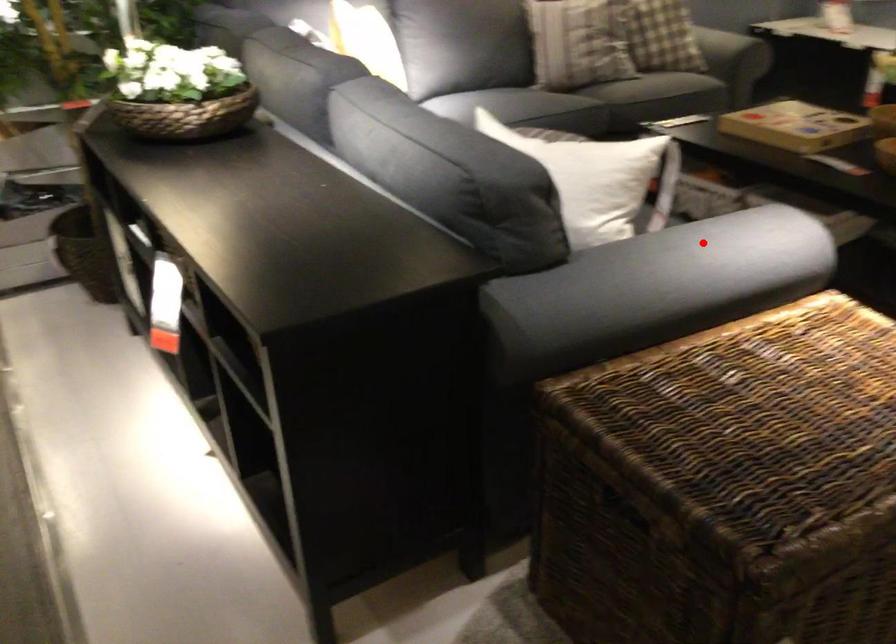
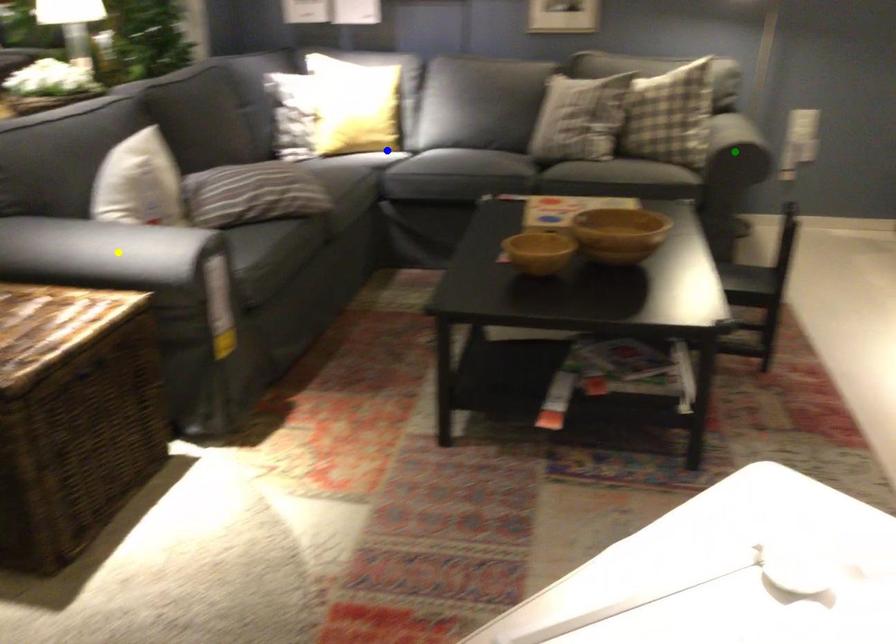
Question: I am providing you with two images of the same scene from different viewpoints. A red point is marked on the first image. You are given multiple points on the second image. Which spot in image 2 lines up with the point in image 1?

Choices:
 (A) yellow point
 (B) green point
 (C) blue point

Answer: (A)